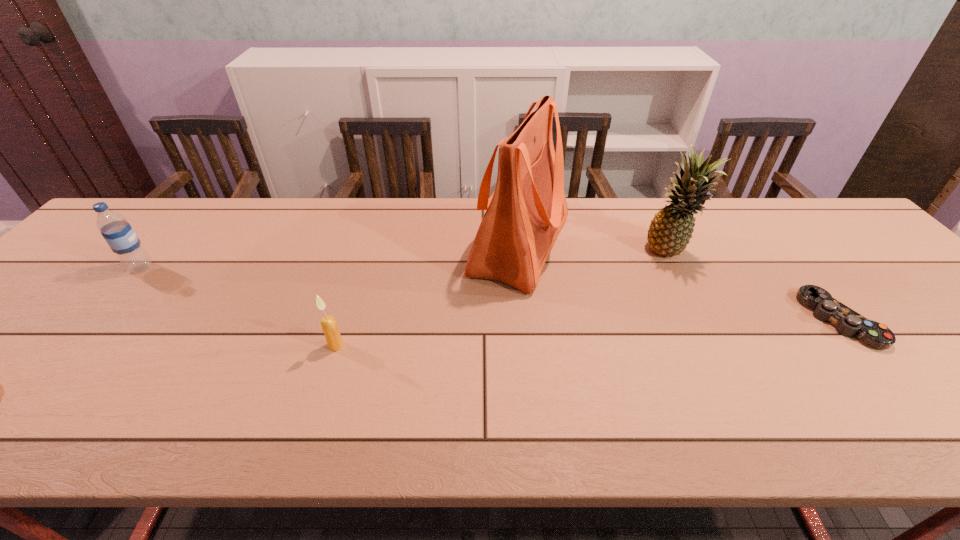
Where is `free space located 0.200m on the left of the shopping bag`? The image size is (960, 540). free space located 0.200m on the left of the shopping bag is located at coordinates (395, 245).

Identify the location of free location located on the front of the pineapple. This screenshot has width=960, height=540. (709, 330).

The image size is (960, 540). Find the location of `vacant space positioned on the label of the leftmost object`. vacant space positioned on the label of the leftmost object is located at coordinates (186, 267).

Find the location of a particular element. The image size is (960, 540). vacant space situated on the right of the second object from left to right is located at coordinates (520, 346).

Identify the location of vacant space situated 0.220m on the left of the rightmost object. (716, 320).

Locate an element on the screen. shopping bag that is at the far edge is located at coordinates (524, 215).

Locate an element on the screen. The image size is (960, 540). pineapple situated at the far edge is located at coordinates (671, 229).

Identify the location of vacant area at the far edge of the desktop. (224, 231).

This screenshot has width=960, height=540. In the image, there is a desktop. Find the location of `blank space at the near edge`. blank space at the near edge is located at coordinates (204, 432).

In the image, there is a desktop. At what (x,y) coordinates should I click in order to perform the action: click on free space at the left edge. Please return your answer as a coordinate pair (x, y). Image resolution: width=960 pixels, height=540 pixels. Looking at the image, I should click on (119, 266).